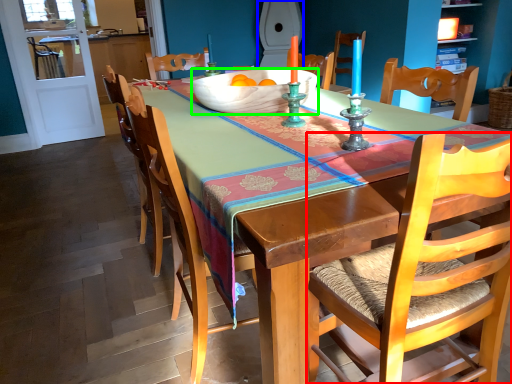
Question: Estimate the real-world distances between objects in this image. Which object is farther from chair (highlighted by a red box), toilet (highlighted by a blue box) or bowl (highlighted by a green box)?

Choices:
 (A) toilet
 (B) bowl

Answer: (A)